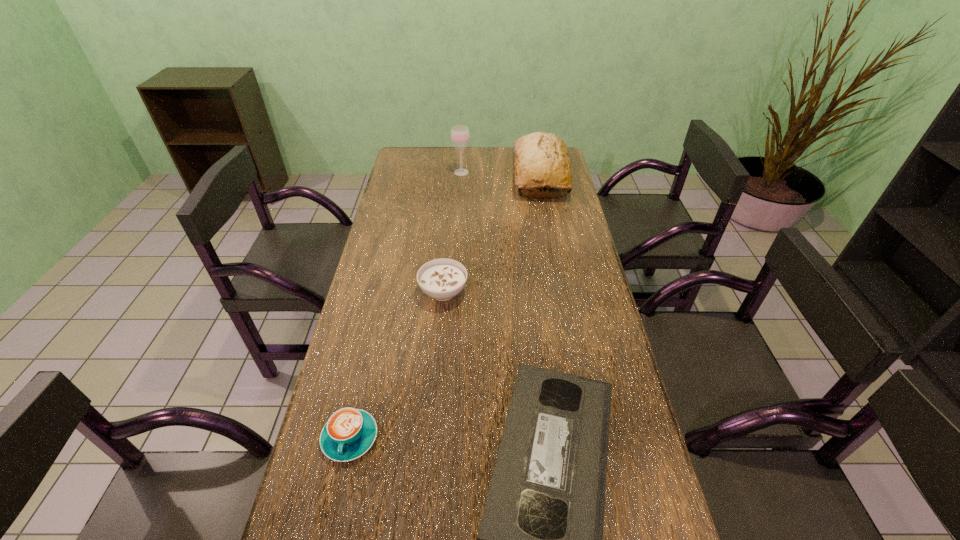
Where is `object located in the left edge section of the desktop`? The height and width of the screenshot is (540, 960). object located in the left edge section of the desktop is located at coordinates (349, 433).

Find the location of a particular element. The image size is (960, 540). object that is at the right edge is located at coordinates (541, 159).

Where is `object that is positioned at the far right corner`? object that is positioned at the far right corner is located at coordinates (541, 159).

The width and height of the screenshot is (960, 540). Find the location of `vacant region at the left edge`. vacant region at the left edge is located at coordinates (411, 292).

You are a GUI agent. You are given a task and a screenshot of the screen. Output one action in this format:
    pyautogui.click(x=<x>, y=<y>)
    Task: Click on the vacant region at the right edge of the desktop
    This screenshot has height=540, width=960.
    Given the screenshot: What is the action you would take?
    pyautogui.click(x=555, y=230)

Where is `vacant space that is in between the bread and the third farthest object`? vacant space that is in between the bread and the third farthest object is located at coordinates [x=492, y=234].

Identify the location of vacant area that lies between the cappuccino and the bread. This screenshot has height=540, width=960. (445, 307).

Find the location of a particular element. This screenshot has width=960, height=540. blank region between the cappuccino and the bread is located at coordinates tap(445, 307).

In order to click on free spot between the soup bowl and the leftmost object in this screenshot , I will do `click(396, 364)`.

Locate an element on the screen. object that is the nearest to the bread is located at coordinates (460, 136).